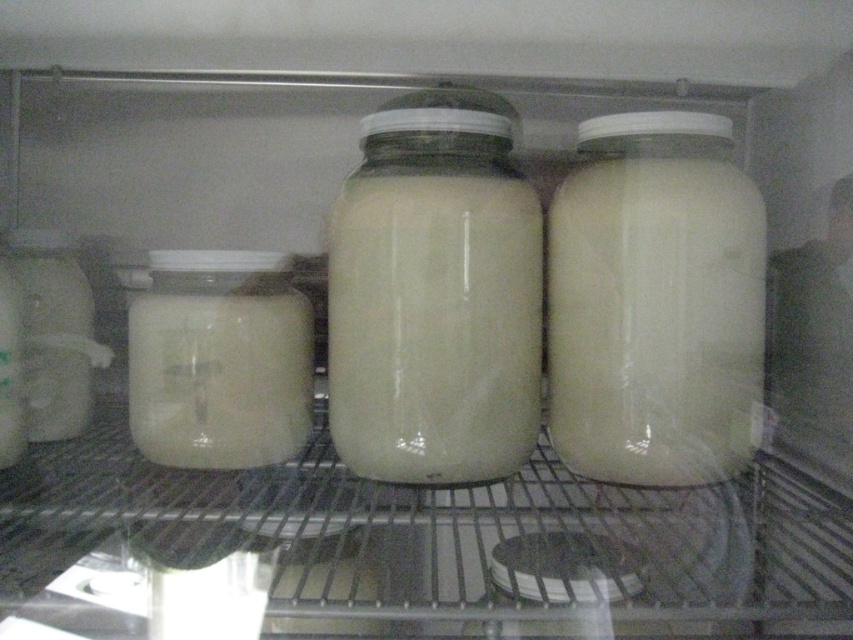
Can you confirm if white glossy jar at right is thinner than white glossy jar at center?

Indeed, white glossy jar at right has a lesser width compared to white glossy jar at center.

Does white glossy jar at right come behind white glossy jar at center?

That is False.

Locate an element on the screen. white glossy jar at right is located at coordinates (654, 320).

Does white glossy jar at right appear on the left side of white matte jar at left?

In fact, white glossy jar at right is to the right of white matte jar at left.

Which of these two, white glossy jar at right or white matte jar at left, stands shorter?

With less height is white matte jar at left.

Does point (624, 413) come closer to viewer compared to point (297, 356)?

Yes, it is in front of point (297, 356).

Locate an element on the screen. white glossy jar at right is located at coordinates (x=654, y=320).

Which is in front, point (662, 209) or point (39, 408)?

Point (662, 209) is more forward.

Does white glossy jar at right have a greater width compared to translucent glass jar at left?

Indeed, white glossy jar at right has a greater width compared to translucent glass jar at left.

Does point (763, 308) lie behind point (67, 358)?

That is False.

Find the location of a particular element. The height and width of the screenshot is (640, 853). white glossy jar at right is located at coordinates (654, 320).